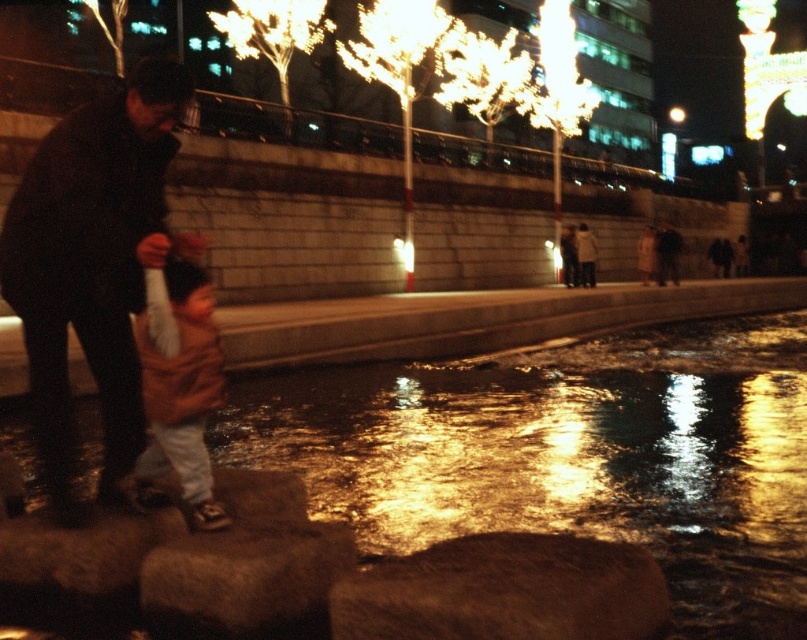
Does dark brown leather jacket at left have a greater width compared to light brown cotton shirt at center?

Indeed, dark brown leather jacket at left has a greater width compared to light brown cotton shirt at center.

Can you confirm if dark brown leather jacket at left is smaller than light brown cotton shirt at center?

Actually, dark brown leather jacket at left might be larger than light brown cotton shirt at center.

What are the coordinates of `dark brown leather jacket at left` in the screenshot? It's located at (90, 260).

Between dark brown leather jacket at left and brown rough stone at center, which one has less height?

brown rough stone at center

Does dark brown leather jacket at left appear on the right side of brown rough stone at center?

Incorrect, dark brown leather jacket at left is not on the right side of brown rough stone at center.

Is point (161, 147) less distant than point (567, 593)?

That is False.

Identify the location of dark brown leather jacket at left. (90, 260).

Can you confirm if brown rough stone at center is wider than light brown cotton shirt at center?

→ Yes.

Between brown rough stone at center and light brown cotton shirt at center, which one appears on the left side from the viewer's perspective?

light brown cotton shirt at center

What do you see at coordinates (504, 592) in the screenshot?
I see `brown rough stone at center` at bounding box center [504, 592].

Image resolution: width=807 pixels, height=640 pixels. Find the location of `brown rough stone at center`. brown rough stone at center is located at coordinates (504, 592).